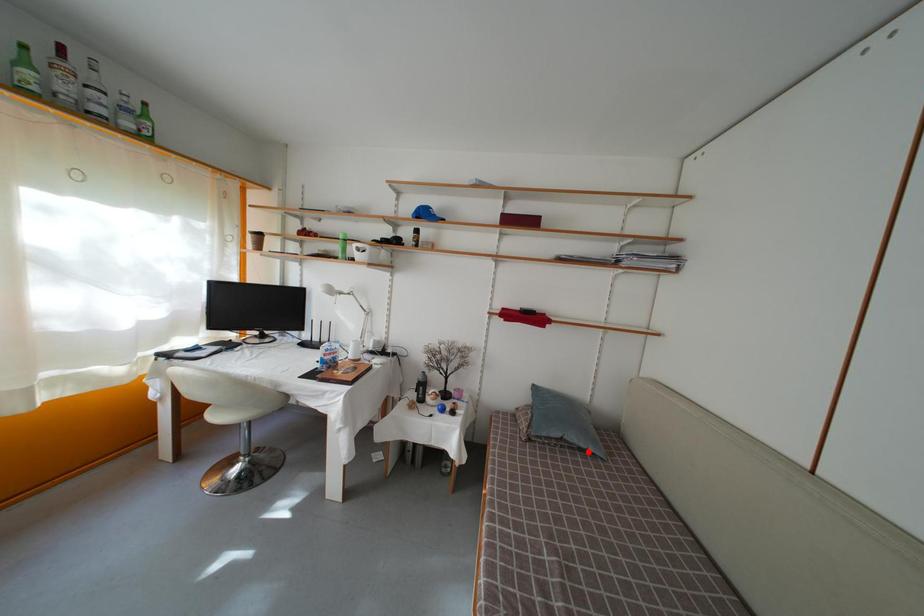
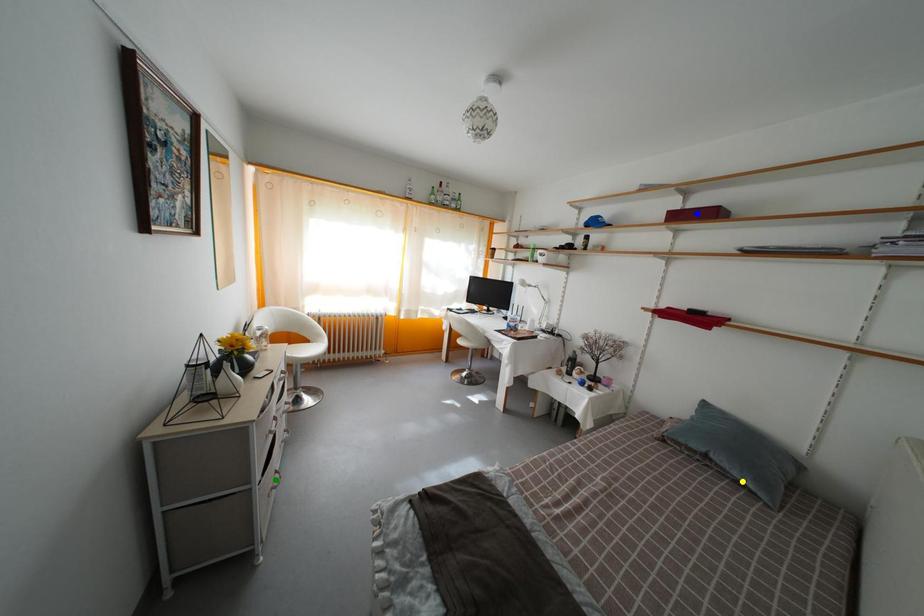
Question: I am providing you with two images of the same scene from different viewpoints. A red point is marked on the first image. You are given multiple points on the second image. Which point in image 2 represents the same 3d spot as the red point in image 1?

Choices:
 (A) yellow point
 (B) blue point
 (C) green point

Answer: (A)